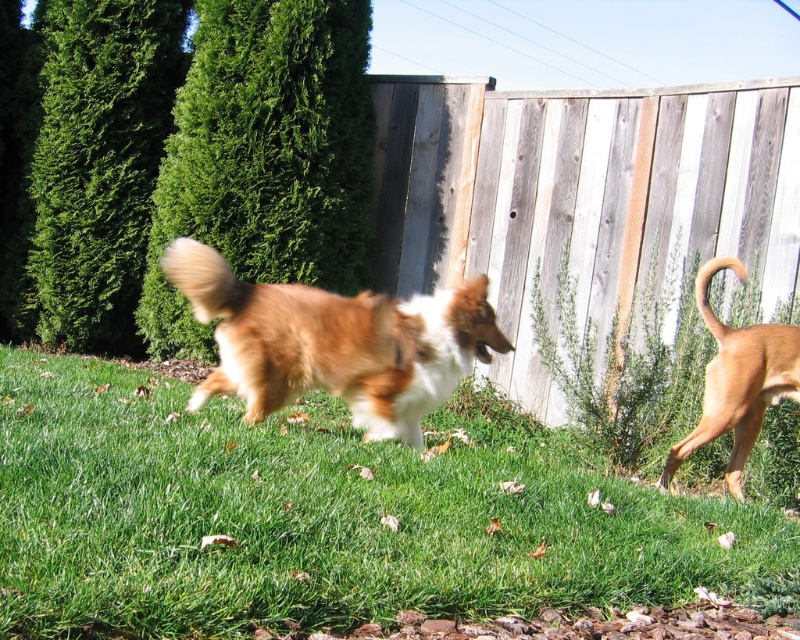
Question: Which object is farther from the camera taking this photo?

Choices:
 (A) brown furry tail at right
 (B) brown furry dog at right
 (C) brown fluffy tail at center

Answer: (A)

Question: Can you confirm if weathered wood fence at center is positioned below brown furry dog at center?

Choices:
 (A) yes
 (B) no

Answer: (B)

Question: Which of these objects is positioned closest to the green grass at center?

Choices:
 (A) weathered wood fence at center
 (B) brown fluffy tail at center
 (C) brown furry dog at center

Answer: (C)

Question: Which of the following is the closest to the observer?

Choices:
 (A) brown furry dog at right
 (B) brown furry dog at center

Answer: (B)

Question: From the image, what is the correct spatial relationship of green grass at center in relation to brown furry dog at center?

Choices:
 (A) left
 (B) right

Answer: (A)

Question: Is green grass at center smaller than brown fluffy tail at center?

Choices:
 (A) yes
 (B) no

Answer: (B)